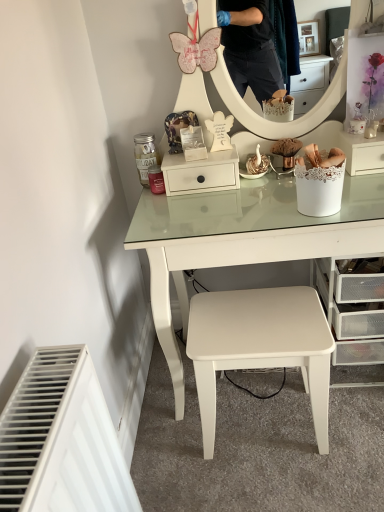
Question: Which direction should I rotate to face white matte drawer at center, placed as the second shelf when sorted from right to left, — up or down?

Choices:
 (A) up
 (B) down

Answer: (A)

Question: Does white matte drawer at center, positioned as the 1th shelf in left-to-right order, have a greater height compared to white lace-covered basket at right, arranged as the second shelf when viewed from the left?

Choices:
 (A) yes
 (B) no

Answer: (A)

Question: Is white matte drawer at center, positioned as the 1th shelf in left-to-right order, not near white lace-covered basket at right, which is the 1th shelf in right-to-left order?

Choices:
 (A) yes
 (B) no

Answer: (B)

Question: Can you confirm if white matte drawer at center, positioned as the 1th shelf in left-to-right order, is wider than white lace-covered basket at right, arranged as the second shelf when viewed from the left?

Choices:
 (A) yes
 (B) no

Answer: (B)

Question: From a real-world perspective, does white matte drawer at center, placed as the second shelf when sorted from right to left, stand above white lace-covered basket at right, arranged as the second shelf when viewed from the left?

Choices:
 (A) no
 (B) yes

Answer: (B)

Question: Can you confirm if white matte drawer at center, positioned as the 1th shelf in left-to-right order, is thinner than white lace-covered basket at right, which is the 1th shelf in right-to-left order?

Choices:
 (A) yes
 (B) no

Answer: (A)

Question: Can you confirm if white matte drawer at center, placed as the second shelf when sorted from right to left, is smaller than white lace-covered basket at right, which is the 1th shelf in right-to-left order?

Choices:
 (A) no
 (B) yes

Answer: (A)

Question: Is white matte stool at center located outside white lace-covered basket at right, which is the 1th shelf in right-to-left order?

Choices:
 (A) no
 (B) yes

Answer: (B)

Question: Is white matte stool at center in front of white lace-covered basket at right, arranged as the second shelf when viewed from the left?

Choices:
 (A) yes
 (B) no

Answer: (A)

Question: Considering the relative positions of white matte stool at center and white lace-covered basket at right, which is the 1th shelf in right-to-left order, in the image provided, is white matte stool at center to the left of white lace-covered basket at right, which is the 1th shelf in right-to-left order, from the viewer's perspective?

Choices:
 (A) yes
 (B) no

Answer: (A)

Question: From the image's perspective, is white matte stool at center over white lace-covered basket at right, which is the 1th shelf in right-to-left order?

Choices:
 (A) yes
 (B) no

Answer: (B)

Question: Is white matte stool at center thinner than white lace-covered basket at right, which is the 1th shelf in right-to-left order?

Choices:
 (A) no
 (B) yes

Answer: (A)

Question: From a real-world perspective, does white matte stool at center stand above white lace-covered basket at right, which is the 1th shelf in right-to-left order?

Choices:
 (A) no
 (B) yes

Answer: (A)

Question: Is white lace-covered basket at right, arranged as the second shelf when viewed from the left, looking in the opposite direction of white matte stool at center?

Choices:
 (A) yes
 (B) no

Answer: (B)